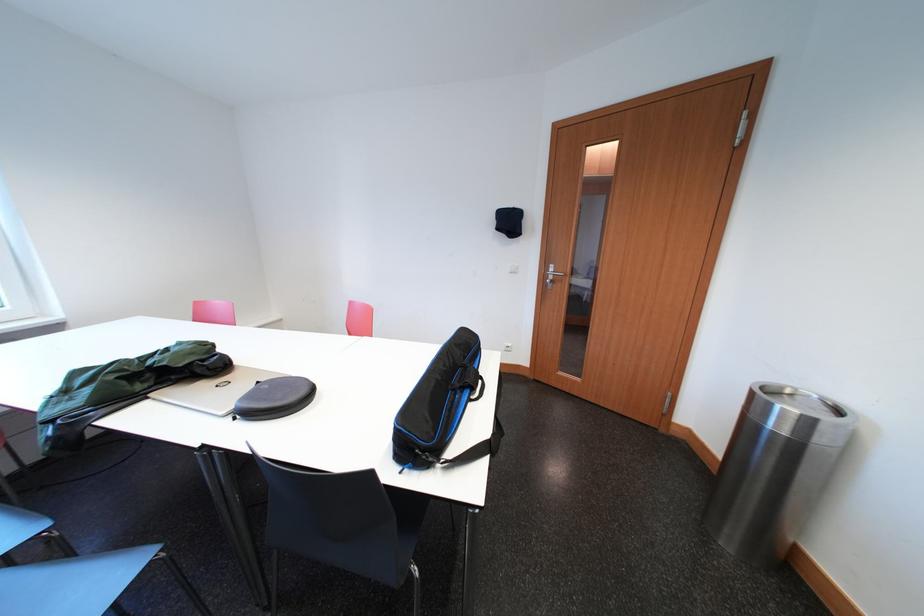
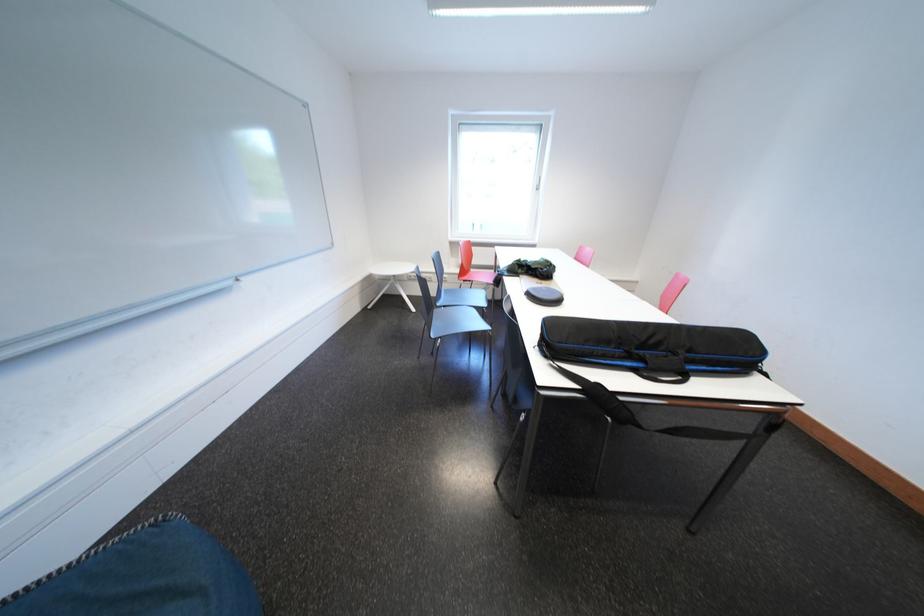
First-person continuous shooting, in which direction is the camera rotating?

The camera rotated toward left-down.